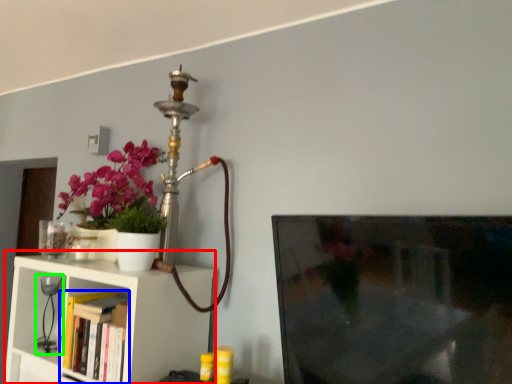
Question: Which object is positioned closest to shelf (highlighted by a red box)? Select from book (highlighted by a blue box) and table lamp (highlighted by a green box).

Choices:
 (A) book
 (B) table lamp

Answer: (A)